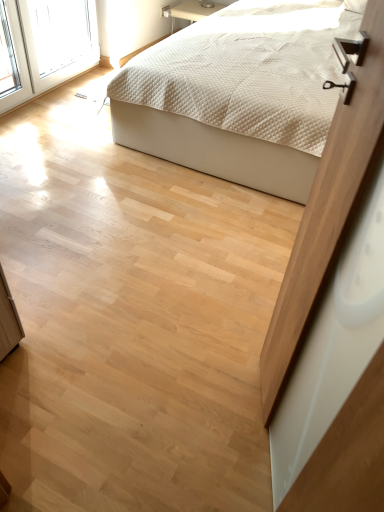
Question: Does white quilted fabric bed at upper center appear on the left side of matte wood screen door at upper right?

Choices:
 (A) no
 (B) yes

Answer: (A)

Question: From the image's perspective, is white quilted fabric bed at upper center located beneath matte wood screen door at upper right?

Choices:
 (A) no
 (B) yes

Answer: (A)

Question: Can you confirm if white quilted fabric bed at upper center is taller than matte wood screen door at upper right?

Choices:
 (A) no
 (B) yes

Answer: (A)

Question: Would you say white quilted fabric bed at upper center is a long distance from matte wood screen door at upper right?

Choices:
 (A) yes
 (B) no

Answer: (A)

Question: Is white quilted fabric bed at upper center closer to camera compared to matte wood screen door at upper right?

Choices:
 (A) no
 (B) yes

Answer: (A)

Question: Is white quilted fabric bed at upper center shorter than matte wood screen door at upper right?

Choices:
 (A) yes
 (B) no

Answer: (A)

Question: Is matte wood screen door at upper right far away from white quilted fabric bed at upper center?

Choices:
 (A) yes
 (B) no

Answer: (A)

Question: Is white quilted fabric bed at upper center inside matte wood screen door at upper right?

Choices:
 (A) no
 (B) yes

Answer: (A)

Question: Is matte wood screen door at upper right at the right side of white quilted fabric bed at upper center?

Choices:
 (A) no
 (B) yes

Answer: (A)

Question: Is matte wood screen door at upper right aimed at white quilted fabric bed at upper center?

Choices:
 (A) yes
 (B) no

Answer: (B)

Question: Is matte wood screen door at upper right thinner than white quilted fabric bed at upper center?

Choices:
 (A) yes
 (B) no

Answer: (A)

Question: Considering the relative sizes of matte wood screen door at upper right and white quilted fabric bed at upper center in the image provided, is matte wood screen door at upper right shorter than white quilted fabric bed at upper center?

Choices:
 (A) yes
 (B) no

Answer: (B)

Question: Is white quilted fabric bed at upper center wider or thinner than matte wood screen door at upper right?

Choices:
 (A) wide
 (B) thin

Answer: (A)